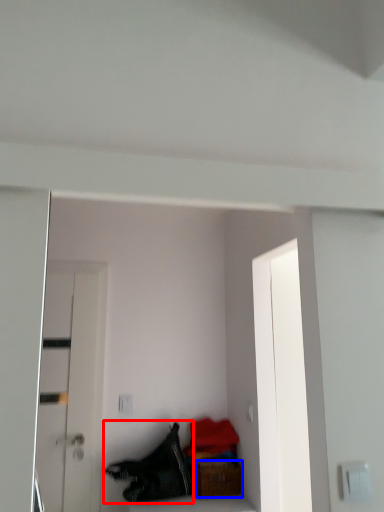
Question: Which point is closer to the camera, clothing (highlighted by a red box) or furniture (highlighted by a blue box)?

Choices:
 (A) clothing
 (B) furniture

Answer: (A)